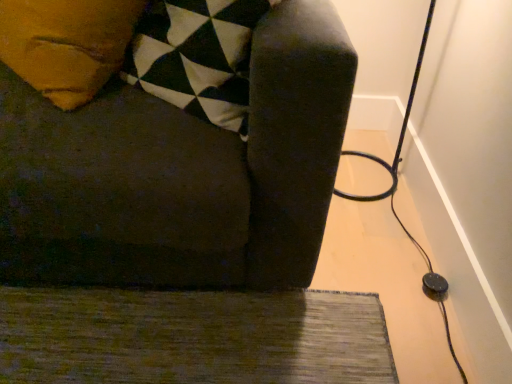
Question: Considering the positions of dark fabric couch at center and green textured rug at lower left in the image, is dark fabric couch at center taller or shorter than green textured rug at lower left?

Choices:
 (A) tall
 (B) short

Answer: (A)

Question: From the image's perspective, is dark fabric couch at center positioned above or below green textured rug at lower left?

Choices:
 (A) below
 (B) above

Answer: (B)

Question: Which is nearer to the green textured rug at lower left?

Choices:
 (A) dark fabric couch at center
 (B) black rubber cable at right

Answer: (A)

Question: Estimate the real-world distances between objects in this image. Which object is farther from the dark fabric couch at center?

Choices:
 (A) black rubber cable at right
 (B) green textured rug at lower left

Answer: (A)